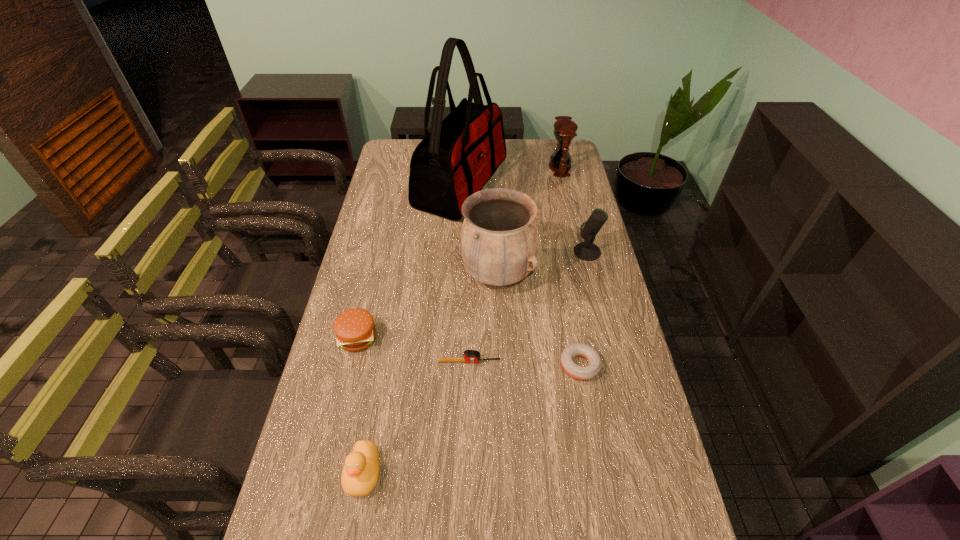
Image resolution: width=960 pixels, height=540 pixels. Find the location of `the tallest object`. the tallest object is located at coordinates (461, 153).

Identify the location of urn. This screenshot has height=540, width=960. (499, 241).

Where is `hourglass`? Image resolution: width=960 pixels, height=540 pixels. hourglass is located at coordinates (565, 129).

Identify the location of microphone. [x=587, y=251].

Locate an element on the screen. Image resolution: width=960 pixels, height=540 pixels. duck is located at coordinates (360, 473).

Find the location of `the fourth shortest object`. the fourth shortest object is located at coordinates (360, 473).

The height and width of the screenshot is (540, 960). What are the coordinates of `hamburger` in the screenshot? It's located at (354, 328).

Image resolution: width=960 pixels, height=540 pixels. What are the coordinates of `tape measure` in the screenshot? It's located at (470, 356).

The height and width of the screenshot is (540, 960). What are the coordinates of `doughnut` in the screenshot? It's located at (590, 371).

Identify the location of free space located on the left of the tallest object. (394, 185).